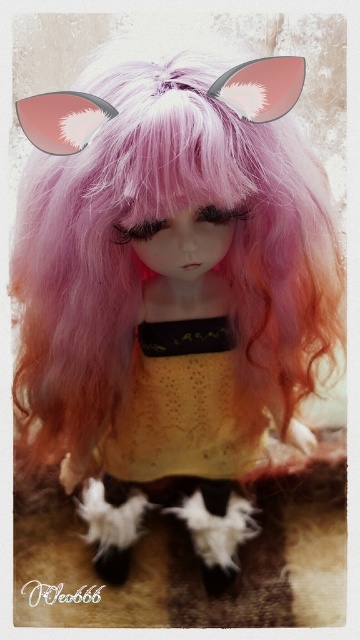
Who is lower down, yellow lace dress at center or matte pink goggles at upper left?

yellow lace dress at center is below.

I want to click on yellow lace dress at center, so click(x=182, y=406).

Does pink matte goggles at upper center appear on the left side of matte pink goggles at upper left?

No, pink matte goggles at upper center is not to the left of matte pink goggles at upper left.

Does point (257, 58) come behind point (69, 145)?

That is False.

Which is in front, point (232, 77) or point (42, 129)?

Positioned in front is point (232, 77).

Where is `pink matte goggles at upper center`? The height and width of the screenshot is (640, 360). pink matte goggles at upper center is located at coordinates (261, 88).

Who is positioned more to the left, yellow lace dress at center or pink matte goggles at upper center?

pink matte goggles at upper center is more to the left.

Is yellow lace dress at center positioned behind pink matte goggles at upper center?

Yes, it is behind pink matte goggles at upper center.

Identify the location of yellow lace dress at center. The height and width of the screenshot is (640, 360). (182, 406).

The image size is (360, 640). What are the coordinates of `yellow lace dress at center` in the screenshot? It's located at pyautogui.click(x=182, y=406).